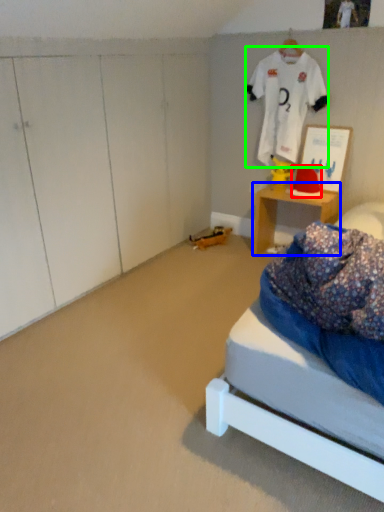
Question: Based on their relative distances, which object is farther from hat (highlighted by a red box)? Choose from desk (highlighted by a blue box) and clothing (highlighted by a green box).

Choices:
 (A) desk
 (B) clothing

Answer: (B)